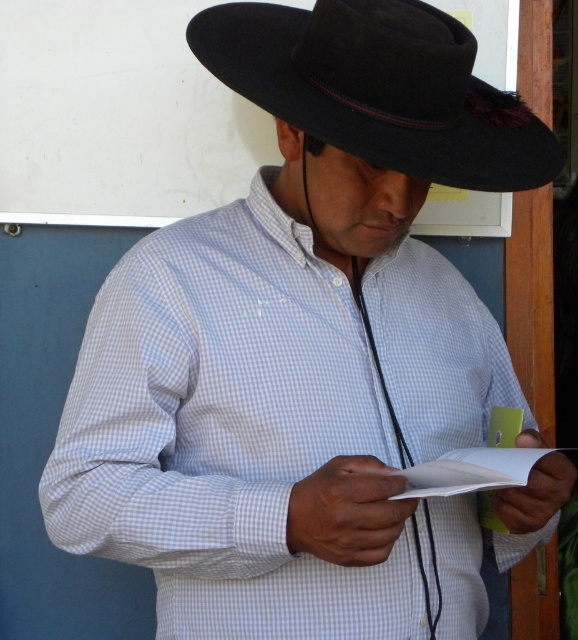
What do you see at coordinates (379, 88) in the screenshot?
I see `black felt fedora at upper center` at bounding box center [379, 88].

Is black felt fedora at upper center further to camera compared to white paper at center?

That is True.

Which is in front, point (305, 122) or point (442, 490)?

Point (442, 490)

Locate an element on the screen. The width and height of the screenshot is (578, 640). black felt fedora at upper center is located at coordinates (379, 88).